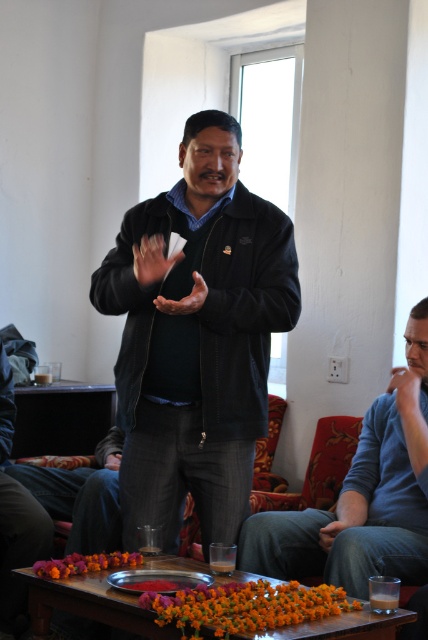
You are a photographer trying to capture a candid shot of the man in the scene. To avoid blocking the view of the jacket, you need to ensure that the hand isn not obscuring it. Based on their positions, is the matte black hand at center currently covering the black matte jacket at center?

The black matte jacket at center is located below the matte black hand at center, so the hand is above the jacket. Since the hand is above, it might not be covering the jacket entirely, but part of it could be blocking the view depending on the angle. However, based on the given information, the hand is positioned higher up, so the jacket is below and likely visible underneath.

You are a photographer trying to capture the central figure in the scene. You notice two hands at the center of the image. Which hand is narrower between the matte black hand at center and the brown leather hand at center?

The matte black hand at center is narrower than the brown leather hand at center.

You are a guest at this gathering and notice two hands at the center of the scene. Which hand is closer to you, the matte black hand at center or the brown leather hand at center?

The matte black hand at center is taller than the brown leather hand at center, so it is closer to you.